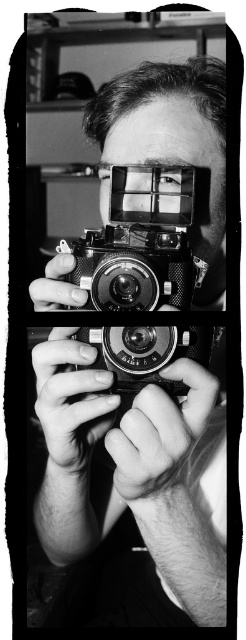
Who is shorter, metallic silver film camera at center or metallic camera at center?

metallic silver film camera at center

Who is more distant from viewer, (76,259) or (216,186)?

The point (216,186) is behind.

I want to click on metallic silver film camera at center, so click(140, 243).